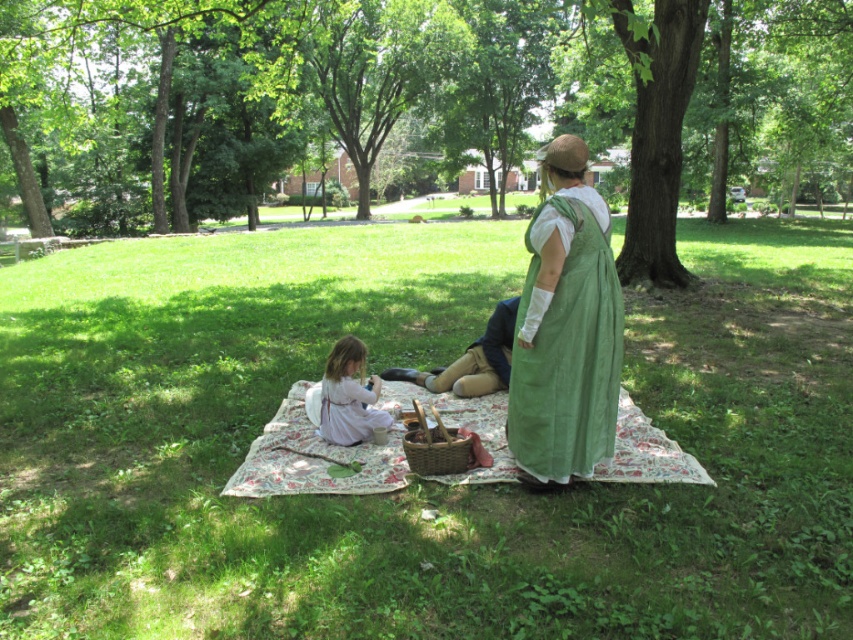
You are setting up a picnic and want to place a plate on the white cotton cloth at center and a napkin on the pale pink fabric at lower left. Which fabric should you place the napkin on first to ensure it is positioned to the left of the plate?

You should place the napkin on the pale pink fabric at lower left first because the white cotton cloth at center is to the right of the pale pink fabric at lower left, so placing the napkin on the pale pink fabric at lower left ensures it is positioned to the left of the plate on the white cotton cloth at center.

You are planning to place a small decorative vase on the picnic blanket. The coordinates for the center of the blanket are at point A. Where should you place the vase to avoid overlapping with the green fabric dress at center?

The green fabric dress at center is located at point [566,330]. To avoid overlapping, place the vase away from this coordinate on the picnic blanket.

You are standing in the park and see the picnic setup. There is a point marked at coordinates [566,330]. What object at the picnic is located at this point?

The green fabric dress at center is located at the coordinates [566,330].